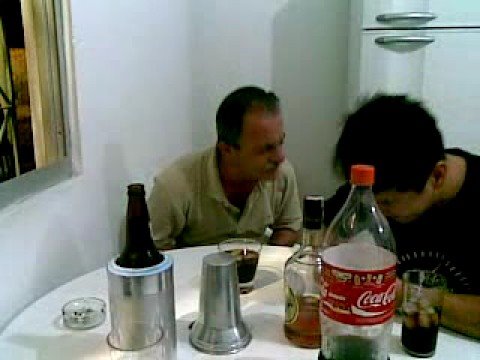
Mark all positions containing where you open the freezer in the image. Your answer should be formatted as a list of tuples, i.e. [(x1, y1), (x2, y2), ...], where each tuple contains the x and y coordinates of a point satisfying the conditions above.

[(413, 17)]